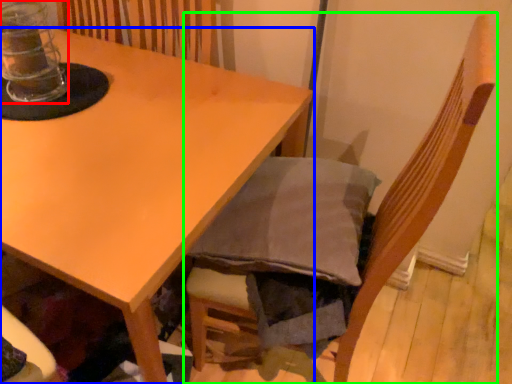
Question: Which object is positioned closest to glass jar (highlighted by a red box)? Select from table (highlighted by a blue box) and chair (highlighted by a green box).

Choices:
 (A) table
 (B) chair

Answer: (A)